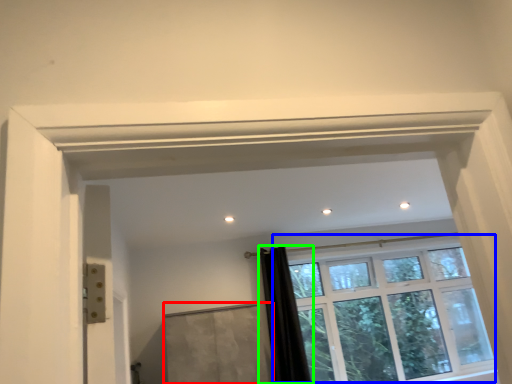
Question: Based on their relative distances, which object is nearer to screen door (highlighted by a red box)? Choose from window (highlighted by a blue box) and shower curtain (highlighted by a green box).

Choices:
 (A) window
 (B) shower curtain

Answer: (B)